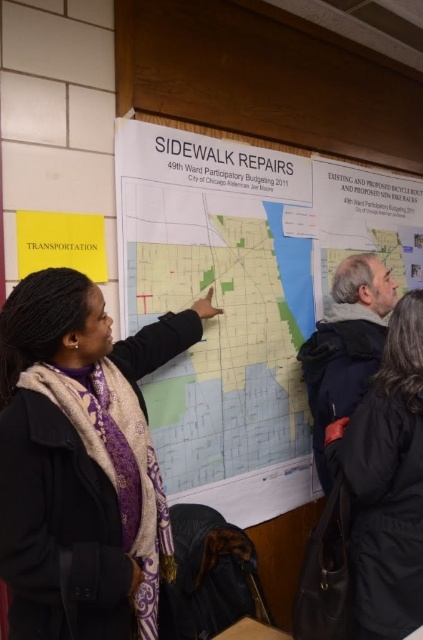
You are attending a community meeting and need to discuss the map with someone. You see the light blue paper map at center and the black wool coat at lower right. Which object is closer to the left side of the room?

The light blue paper map at center is closer to the left side of the room because it is to the left of the black wool coat at lower right.

You are attending a community meeting and need to present your proposal for the sidewalk repairs. You have a matte black scarf at center and a white paper map at center. Which object can you use to better highlight the proposed repair areas on the map?

The white paper map at center is larger in size than the matte black scarf at center, so you can use the white paper map at center to better highlight the proposed repair areas since it provides a larger surface for annotations.